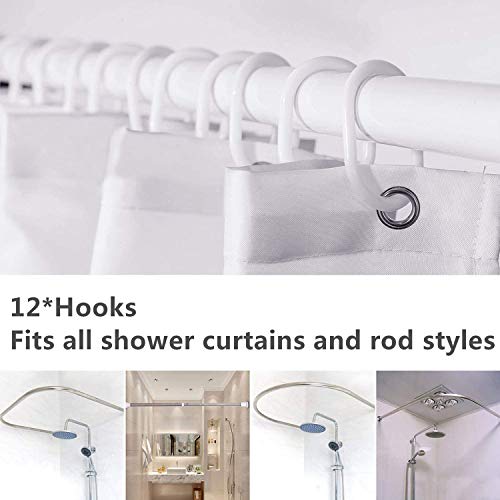
At what (x,y) coordinates should I click in order to perform the action: click on hook. Please return your answer as a coordinate pair (x, y). Looking at the image, I should click on (70, 96).